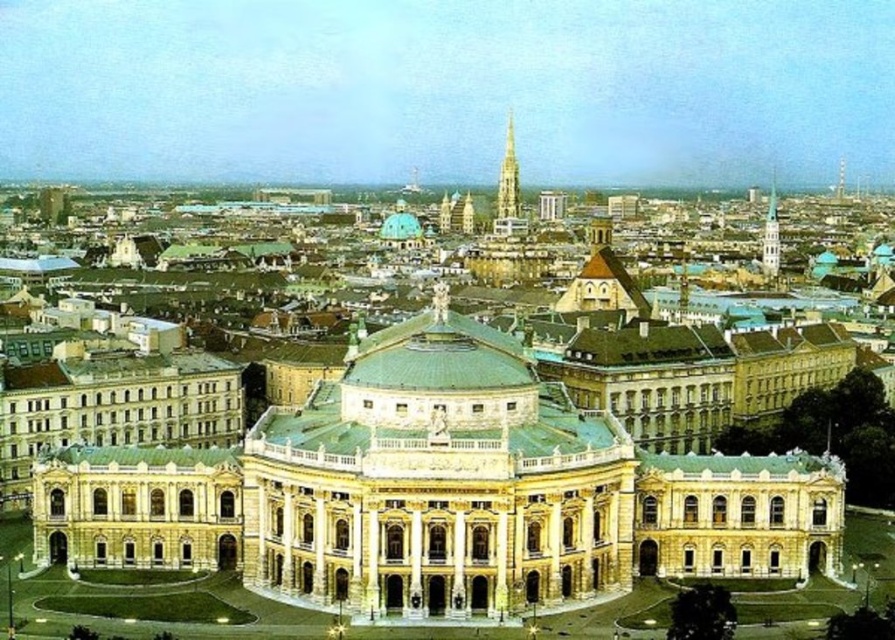
You are standing in the city square and want to take a photo of both the golden spire at center and the gold textured spire at upper right. Which spire should you position to your left to capture both in the frame?

You should position the golden spire at center to your left since it is already to the left of the gold textured spire at upper right, allowing both to be captured in the frame.

You are an architect evaluating the spatial layout of the cityscape. Given that the beige stone palace at center and the gold textured spire at upper right are both key landmarks, which of these two structures has a greater horizontal extent when viewed from your current vantage point?

The beige stone palace at center has a greater horizontal extent than the gold textured spire at upper right because its width is larger, as stated in the description.

You are standing in a city park and want to take a photo of the beige stone palace at center. If your camera has a maximum zoom range of 100 meters, will you be able to capture the entire palace in a single frame without moving closer?

The beige stone palace at center is 104.00 meters away from the viewer. Since the camera can only zoom up to 100 meters, you will not be able to capture the entire palace in a single frame without moving closer.